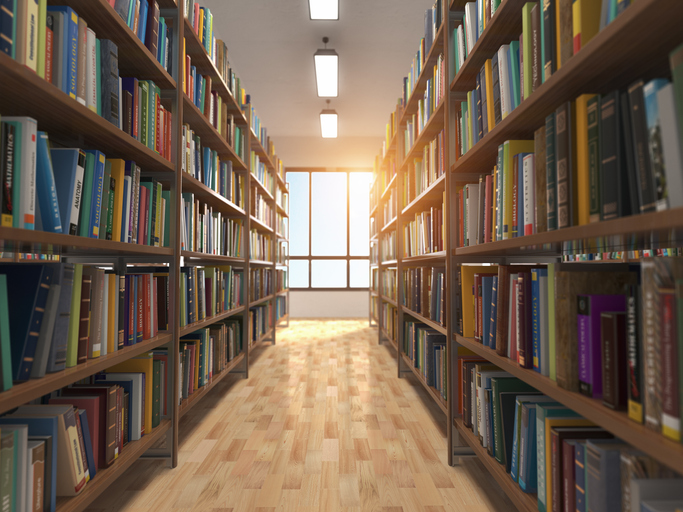
Find the location of `windows`. windows is located at coordinates (296, 251), (303, 273), (341, 260), (341, 225), (362, 239), (360, 272).